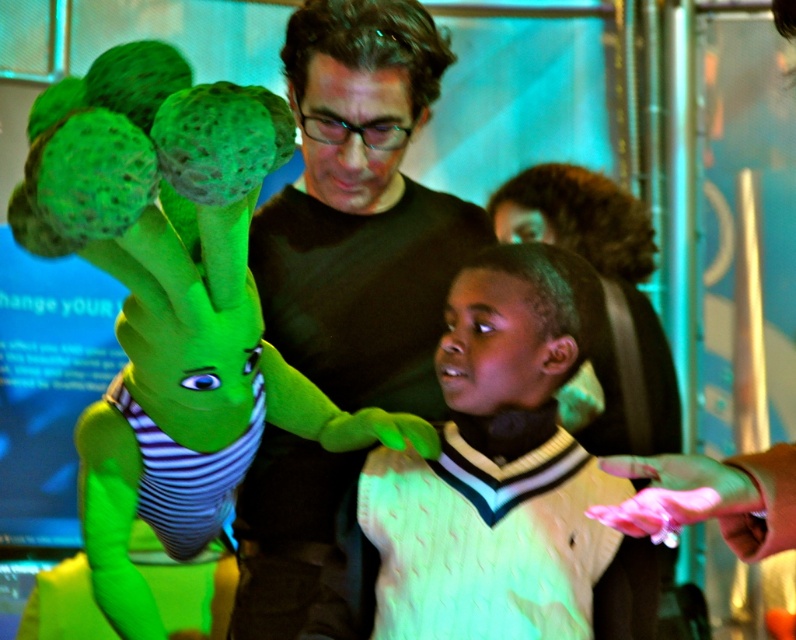
Question: Does green rubber alien at upper left have a smaller size compared to white knitted sweater at center?

Choices:
 (A) yes
 (B) no

Answer: (B)

Question: Does matte black sweater at center have a smaller size compared to white knitted sweater at center?

Choices:
 (A) yes
 (B) no

Answer: (B)

Question: Which object is farther from the camera taking this photo?

Choices:
 (A) white knitted sweater at center
 (B) matte black sweater at center
 (C) green rubber alien at upper left

Answer: (B)

Question: Which point is closer to the camera?

Choices:
 (A) (86, 148)
 (B) (436, 401)

Answer: (A)

Question: Which point appears closest to the camera in this image?

Choices:
 (A) (467, 353)
 (B) (276, 460)
 (C) (221, 419)

Answer: (A)

Question: Does green rubber alien at upper left have a larger size compared to matte black sweater at center?

Choices:
 (A) yes
 (B) no

Answer: (A)